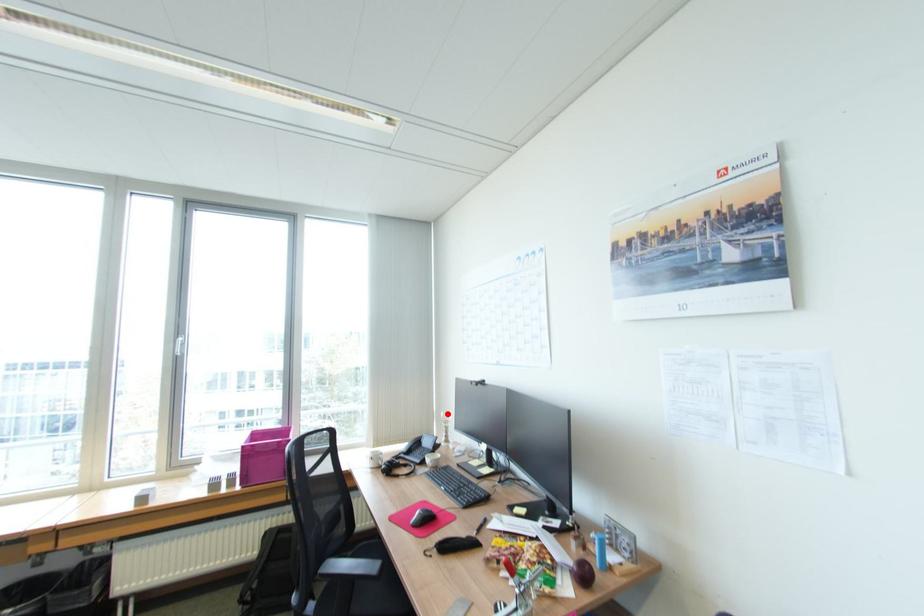
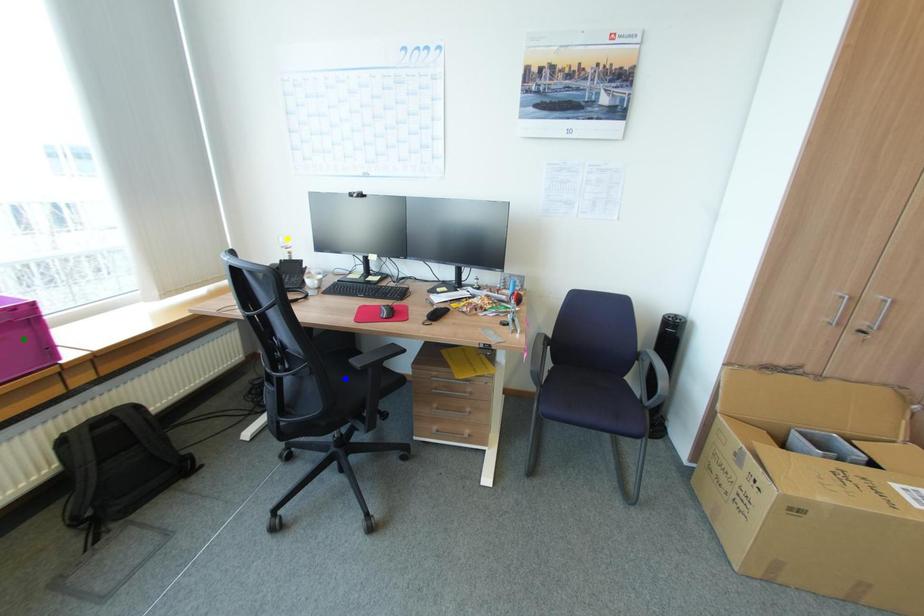
Question: I am providing you with two images of the same scene from different viewpoints. A red point is marked on the first image. You are given multiple points on the second image. Can you choose the point in image 2 that corresponds to the point in image 1?

Choices:
 (A) blue point
 (B) yellow point
 (C) green point

Answer: (B)